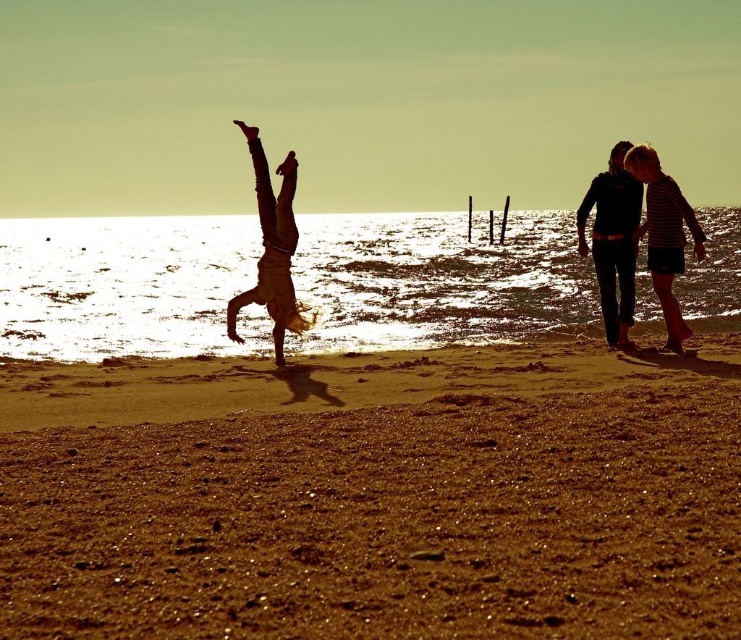
Question: Which object appears farthest from the camera in this image?

Choices:
 (A) silhouette clothing at right
 (B) brown sandy beach at center

Answer: (A)

Question: Which object is the farthest from the silhouette clothing at right?

Choices:
 (A) brown sandy beach at center
 (B) silhouette figure at center

Answer: (A)

Question: Which point is farther to the camera?

Choices:
 (A) (227, 568)
 (B) (285, 289)
 (C) (614, 163)

Answer: (C)

Question: Is the position of brown sandy beach at center less distant than that of silhouette clothing at right?

Choices:
 (A) no
 (B) yes

Answer: (B)

Question: Can you confirm if brown sandy beach at center is positioned to the right of silhouette clothing at right?

Choices:
 (A) yes
 (B) no

Answer: (B)

Question: Is the position of silhouette clothing at right less distant than that of silhouette figure at center?

Choices:
 (A) yes
 (B) no

Answer: (A)